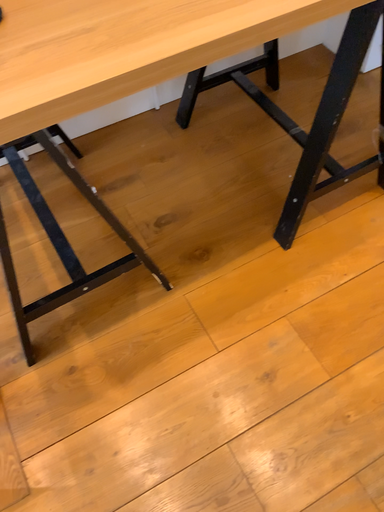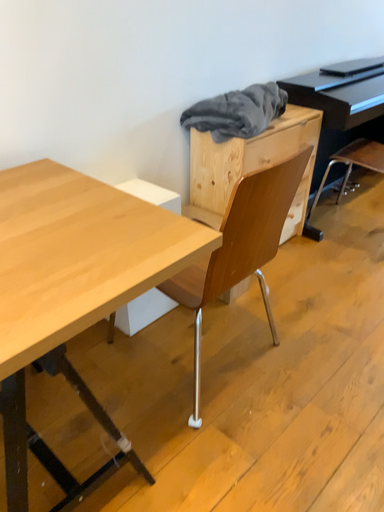
Question: How did the camera likely rotate when shooting the video?

Choices:
 (A) rotated left
 (B) rotated right

Answer: (B)